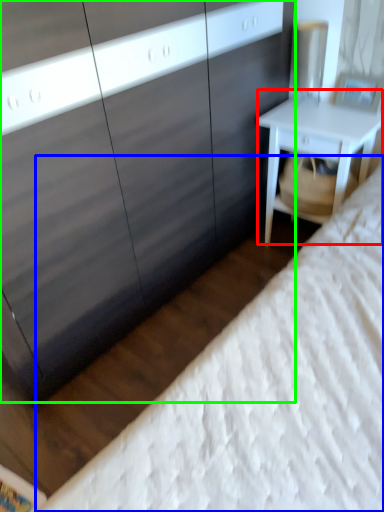
Question: Which object is the closest to the nightstand (highlighted by a red box)? Choose among these: bed (highlighted by a blue box) or dresser (highlighted by a green box).

Choices:
 (A) bed
 (B) dresser

Answer: (B)